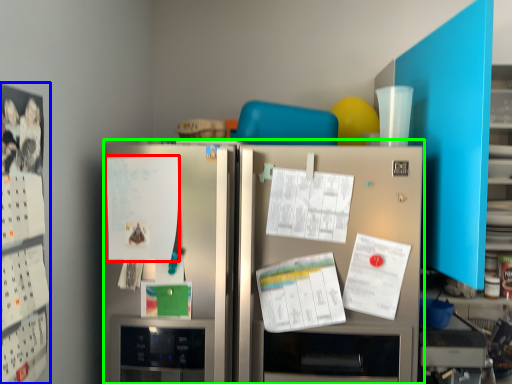
Question: Which is nearer to the poster (highlighted by a red box)? bulletin board (highlighted by a blue box) or refrigerator (highlighted by a green box).

Choices:
 (A) bulletin board
 (B) refrigerator

Answer: (B)